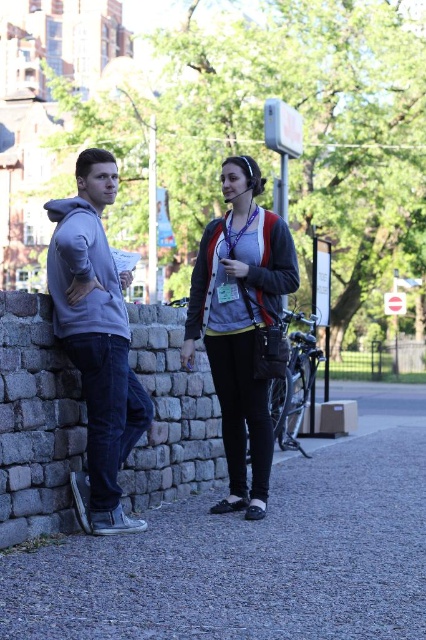
Question: Which point appears closest to the camera in this image?

Choices:
 (A) (238, 452)
 (B) (106, 396)
 (C) (305, 579)

Answer: (C)

Question: Which of these objects is positioned closest to the matte black jacket at center?

Choices:
 (A) gray hoodie at left
 (B) matte gray hoodie at left

Answer: (A)

Question: Does gray gravel pavement at lower center appear on the left side of matte gray hoodie at left?

Choices:
 (A) no
 (B) yes

Answer: (A)

Question: Does gray hoodie at left have a larger size compared to matte gray hoodie at left?

Choices:
 (A) yes
 (B) no

Answer: (B)

Question: Can you confirm if gray hoodie at left is thinner than matte black jacket at center?

Choices:
 (A) yes
 (B) no

Answer: (B)

Question: Which of the following is the farthest from the observer?

Choices:
 (A) (x=250, y=298)
 (B) (x=261, y=433)
 (C) (x=80, y=243)

Answer: (B)